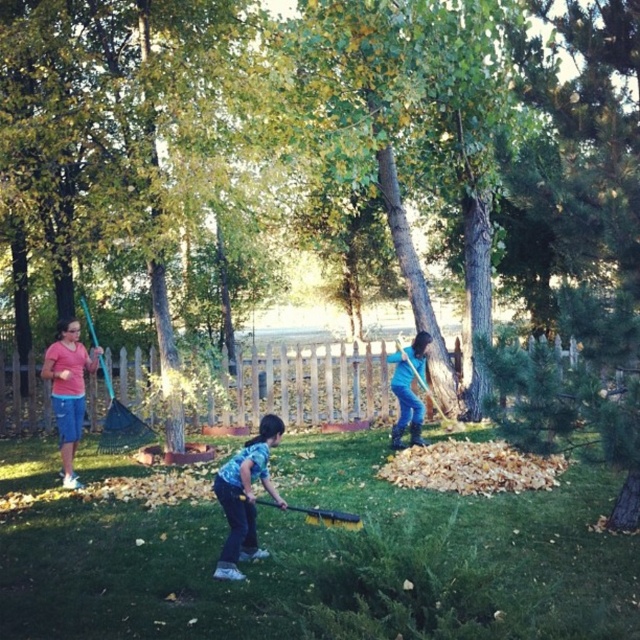
Who is positioned more to the left, blue plastic shovel at left or wooden shovel at right?

From the viewer's perspective, blue plastic shovel at left appears more on the left side.

Consider the image. Does blue plastic shovel at left have a smaller size compared to wooden shovel at right?

Correct, blue plastic shovel at left occupies less space than wooden shovel at right.

Locate an element on the screen. The image size is (640, 640). blue plastic shovel at left is located at coordinates click(120, 422).

Can you confirm if blue jeans at center is positioned to the right of blue plastic shovel at left?

Yes, blue jeans at center is to the right of blue plastic shovel at left.

Is blue jeans at center closer to camera compared to blue plastic shovel at left?

No, it is behind blue plastic shovel at left.

Between point (413, 416) and point (104, 448), which one is positioned in front?

Point (413, 416) is in front.

Where is `blue jeans at center`? Image resolution: width=640 pixels, height=640 pixels. blue jeans at center is located at coordinates (x=408, y=388).

Looking at this image, can you confirm if matte pink shirt at left is positioned below wooden shovel at right?

Indeed, matte pink shirt at left is positioned under wooden shovel at right.

Is the position of matte pink shirt at left less distant than that of wooden shovel at right?

Yes, matte pink shirt at left is in front of wooden shovel at right.

In order to click on matte pink shirt at left in this screenshot , I will do `click(68, 390)`.

The height and width of the screenshot is (640, 640). What are the coordinates of `matte pink shirt at left` in the screenshot? It's located at (68, 390).